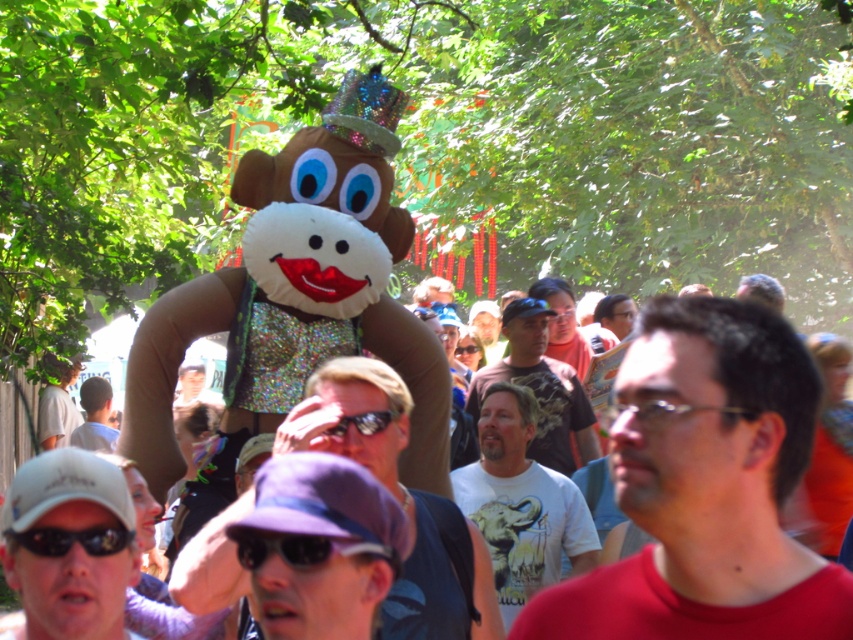
Question: Among these points, which one is farthest from the camera?

Choices:
 (A) (503, 426)
 (B) (643, 522)

Answer: (A)

Question: Can you confirm if white t-shirt with elephant graphic at center is positioned to the right of bearded man at center?

Choices:
 (A) yes
 (B) no

Answer: (B)

Question: Is bearded man at center below light blue shirt at center?

Choices:
 (A) yes
 (B) no

Answer: (B)

Question: Considering the real-world distances, which object is farthest from the matte red shirt at center?

Choices:
 (A) light blue shirt at center
 (B) white t-shirt with elephant graphic at center
 (C) white matte cap at lower left

Answer: (A)

Question: Among these objects, which one is farthest from the camera?

Choices:
 (A) bearded man at center
 (B) purple fabric hat at center
 (C) white matte cap at lower left

Answer: (A)

Question: Is matte red shirt at center wider than bearded man at center?

Choices:
 (A) no
 (B) yes

Answer: (A)